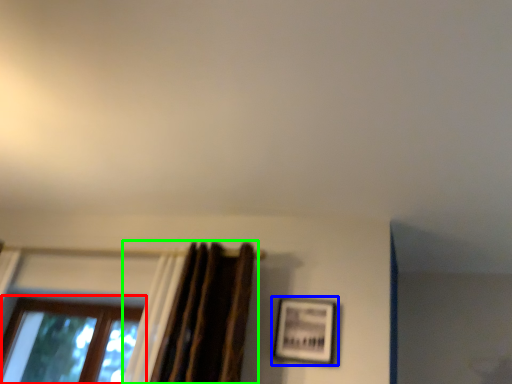
Question: Which object is positioned closest to window (highlighted by a red box)? Select from picture frame (highlighted by a blue box) and curtain (highlighted by a green box).

Choices:
 (A) picture frame
 (B) curtain

Answer: (B)